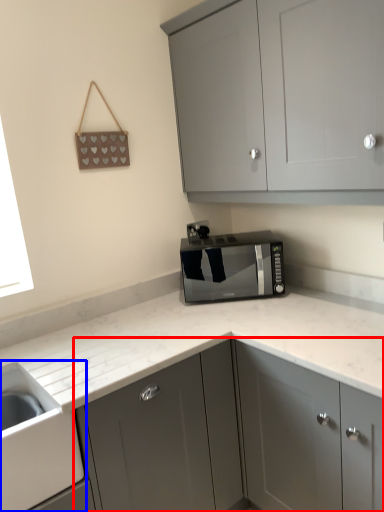
Question: Among these objects, which one is nearest to the camera, cabinetry (highlighted by a red box) or sink (highlighted by a blue box)?

Choices:
 (A) cabinetry
 (B) sink

Answer: (B)